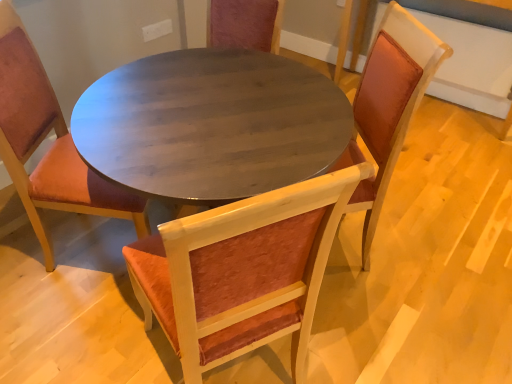
Question: Would you say velvet orange chair at center, which is the second chair from left to right, is part of velvet orange chair at center, placed as the 3th chair when sorted from right to left,'s contents?

Choices:
 (A) no
 (B) yes

Answer: (A)

Question: Is velvet orange chair at center, which ranks as the first chair in left-to-right order, shorter than velvet orange chair at center, which is the second chair from left to right?

Choices:
 (A) yes
 (B) no

Answer: (A)

Question: From the image's perspective, is velvet orange chair at center, placed as the 3th chair when sorted from right to left, on top of velvet orange chair at center, the 2th chair viewed from the right?

Choices:
 (A) yes
 (B) no

Answer: (A)

Question: From a real-world perspective, is velvet orange chair at center, placed as the 3th chair when sorted from right to left, over velvet orange chair at center, which is the second chair from left to right?

Choices:
 (A) yes
 (B) no

Answer: (A)

Question: Is velvet orange chair at center, placed as the 3th chair when sorted from right to left, aimed at velvet orange chair at center, the 2th chair viewed from the right?

Choices:
 (A) no
 (B) yes

Answer: (A)

Question: Is point (384, 82) positioned closer to the camera than point (301, 372)?

Choices:
 (A) farther
 (B) closer

Answer: (A)

Question: From their relative heights in the image, would you say velvet orange chair at center, which is counted as the 3th chair, starting from the left, is taller or shorter than velvet orange chair at center, the 2th chair viewed from the right?

Choices:
 (A) tall
 (B) short

Answer: (A)

Question: Would you say velvet orange chair at center, which ranks as the first chair in right-to-left order, is to the left or to the right of velvet orange chair at center, which is the second chair from left to right, in the picture?

Choices:
 (A) left
 (B) right

Answer: (B)

Question: Relative to velvet orange chair at center, which is the second chair from left to right, is velvet orange chair at center, which ranks as the first chair in right-to-left order, in front or behind?

Choices:
 (A) behind
 (B) front

Answer: (A)

Question: Is velvet orange chair at center, which is the second chair from left to right, wider or thinner than velvet orange chair at center, which ranks as the first chair in left-to-right order?

Choices:
 (A) thin
 (B) wide

Answer: (B)

Question: From the image's perspective, relative to velvet orange chair at center, which ranks as the first chair in left-to-right order, is velvet orange chair at center, the 2th chair viewed from the right, above or below?

Choices:
 (A) below
 (B) above

Answer: (A)

Question: From a real-world perspective, is velvet orange chair at center, which is the second chair from left to right, above or below velvet orange chair at center, placed as the 3th chair when sorted from right to left?

Choices:
 (A) below
 (B) above

Answer: (A)

Question: From their relative heights in the image, would you say velvet orange chair at center, the 2th chair viewed from the right, is taller or shorter than velvet orange chair at center, which ranks as the first chair in left-to-right order?

Choices:
 (A) tall
 (B) short

Answer: (A)

Question: From a real-world perspective, is velvet orange chair at center, which is the second chair from left to right, above or below velvet orange chair at center, which ranks as the first chair in right-to-left order?

Choices:
 (A) below
 (B) above

Answer: (A)

Question: In terms of height, does velvet orange chair at center, which is the second chair from left to right, look taller or shorter compared to velvet orange chair at center, which ranks as the first chair in right-to-left order?

Choices:
 (A) tall
 (B) short

Answer: (B)